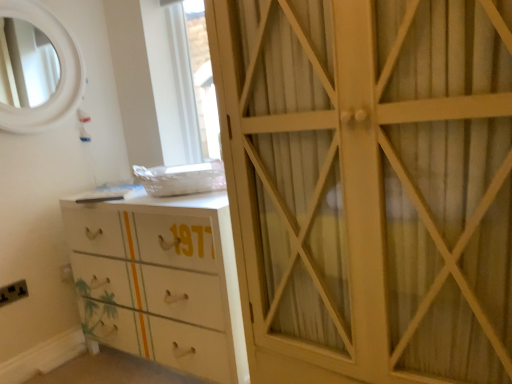
Question: Is white glossy chest of drawers at lower left surrounded by white wood cabinet at right?

Choices:
 (A) yes
 (B) no

Answer: (B)

Question: Considering the relative sizes of white wood cabinet at right and white glossy chest of drawers at lower left in the image provided, is white wood cabinet at right wider than white glossy chest of drawers at lower left?

Choices:
 (A) yes
 (B) no

Answer: (A)

Question: Is white wood cabinet at right turned away from white glossy chest of drawers at lower left?

Choices:
 (A) no
 (B) yes

Answer: (A)

Question: Could you tell me if white wood cabinet at right is facing white glossy chest of drawers at lower left?

Choices:
 (A) no
 (B) yes

Answer: (A)

Question: From the image's perspective, is white wood cabinet at right above white glossy chest of drawers at lower left?

Choices:
 (A) yes
 (B) no

Answer: (A)

Question: Considering the relative sizes of white wood cabinet at right and white glossy chest of drawers at lower left in the image provided, is white wood cabinet at right taller than white glossy chest of drawers at lower left?

Choices:
 (A) yes
 (B) no

Answer: (A)

Question: From the image's perspective, is white wood cabinet at right beneath black plastic electric outlet at lower left?

Choices:
 (A) no
 (B) yes

Answer: (A)

Question: Does white wood cabinet at right have a lesser height compared to black plastic electric outlet at lower left?

Choices:
 (A) no
 (B) yes

Answer: (A)

Question: From a real-world perspective, is white wood cabinet at right physically below black plastic electric outlet at lower left?

Choices:
 (A) no
 (B) yes

Answer: (A)

Question: Is white wood cabinet at right aimed at black plastic electric outlet at lower left?

Choices:
 (A) yes
 (B) no

Answer: (B)

Question: Can you confirm if white wood cabinet at right is taller than black plastic electric outlet at lower left?

Choices:
 (A) yes
 (B) no

Answer: (A)

Question: Is white wood cabinet at right thinner than black plastic electric outlet at lower left?

Choices:
 (A) yes
 (B) no

Answer: (B)

Question: Can you confirm if black plastic electric outlet at lower left is wider than white wood cabinet at right?

Choices:
 (A) no
 (B) yes

Answer: (A)